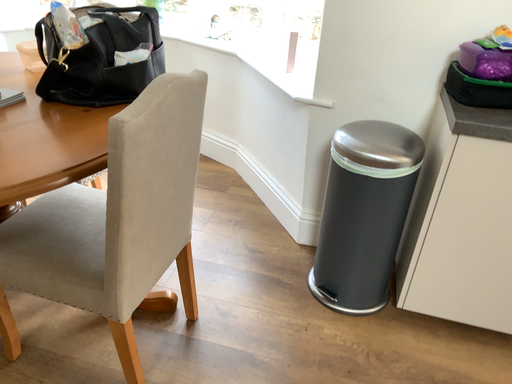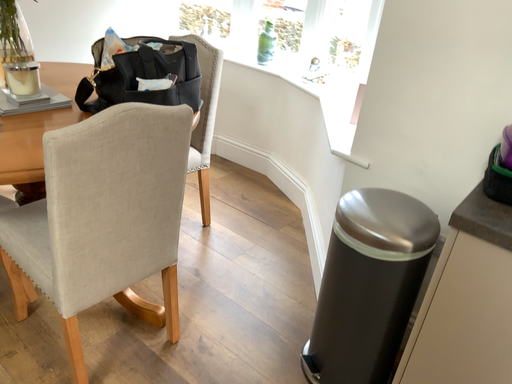
Question: How did the camera likely rotate when shooting the video?

Choices:
 (A) rotated upward
 (B) rotated downward

Answer: (A)